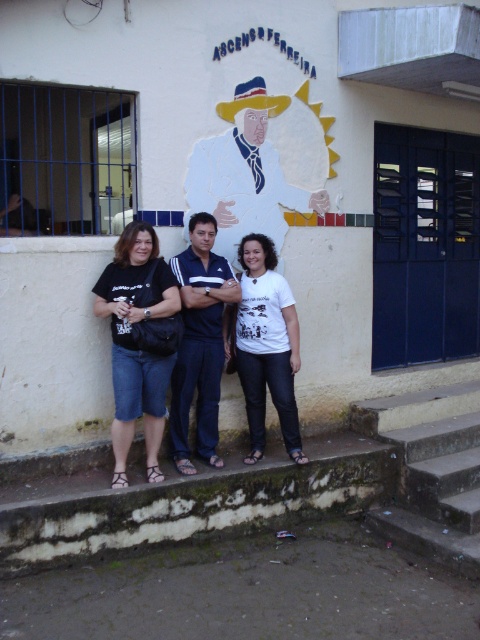
You are standing at the point marked by the coordinates point (439, 392). You want to walk to the building with the mural. Is the building in front of you or behind you?

The building with the mural is in front of you because you are at point (439, 392) and the viewer is 20.71 feet away from the point, indicating the building is in the direction you are facing.

You are a photographer trying to capture a shot of the white matte shirt at center and the concrete stairs at lower right. Based on their heights, which one should you focus on first if you want to ensure both are in frame without adjusting your camera angle?

The concrete stairs at lower right has a lesser height compared to white matte shirt at center, so you should focus on the white matte shirt at center first to ensure both are in frame without adjusting your camera angle.